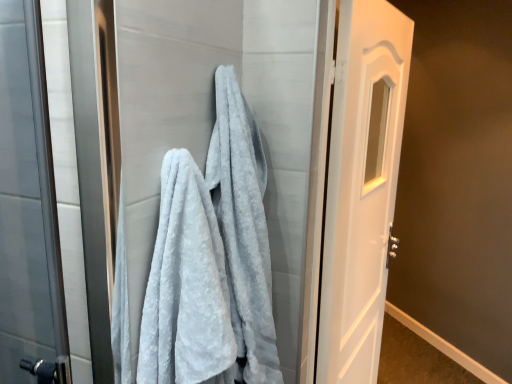
Question: From the image's perspective, would you say white glossy door at right is shown under gray fluffy towel at center?

Choices:
 (A) yes
 (B) no

Answer: (A)

Question: Is white glossy door at right at the left side of gray fluffy towel at center?

Choices:
 (A) no
 (B) yes

Answer: (A)

Question: Is white glossy door at right positioned before gray fluffy towel at center?

Choices:
 (A) no
 (B) yes

Answer: (A)

Question: Is white glossy door at right shorter than gray fluffy towel at center?

Choices:
 (A) no
 (B) yes

Answer: (A)

Question: Can you confirm if white glossy door at right is thinner than gray fluffy towel at center?

Choices:
 (A) no
 (B) yes

Answer: (B)

Question: Which is correct: light gray fluffy towel at center is inside gray fluffy towel at center, or outside of it?

Choices:
 (A) outside
 (B) inside

Answer: (A)

Question: From their relative heights in the image, would you say light gray fluffy towel at center is taller or shorter than gray fluffy towel at center?

Choices:
 (A) short
 (B) tall

Answer: (A)

Question: In terms of width, does light gray fluffy towel at center look wider or thinner when compared to gray fluffy towel at center?

Choices:
 (A) thin
 (B) wide

Answer: (A)

Question: In terms of size, does light gray fluffy towel at center appear bigger or smaller than gray fluffy towel at center?

Choices:
 (A) big
 (B) small

Answer: (B)

Question: Is point (200, 26) closer or farther from the camera than point (378, 208)?

Choices:
 (A) closer
 (B) farther

Answer: (A)

Question: In terms of size, does gray fluffy towel at center appear bigger or smaller than white glossy door at right?

Choices:
 (A) small
 (B) big

Answer: (A)

Question: Choose the correct answer: Is gray fluffy towel at center inside white glossy door at right or outside it?

Choices:
 (A) outside
 (B) inside

Answer: (A)

Question: Based on their positions, is gray fluffy towel at center located to the left or right of white glossy door at right?

Choices:
 (A) left
 (B) right

Answer: (A)

Question: Is white glossy door at right in front of or behind gray fluffy towel at center in the image?

Choices:
 (A) front
 (B) behind

Answer: (B)

Question: In the image, is white glossy door at right on the left side or the right side of gray fluffy towel at center?

Choices:
 (A) left
 (B) right

Answer: (B)